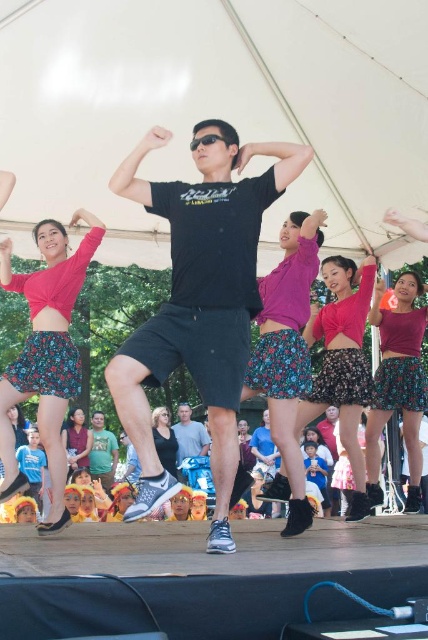
Is black matte t-shirt at center positioned before black leather shoes at lower center?

Yes, it is in front of black leather shoes at lower center.

Is black matte t-shirt at center below black leather shoes at lower center?

Incorrect, black matte t-shirt at center is not positioned below black leather shoes at lower center.

Find the location of a particular element. black matte t-shirt at center is located at coordinates (199, 300).